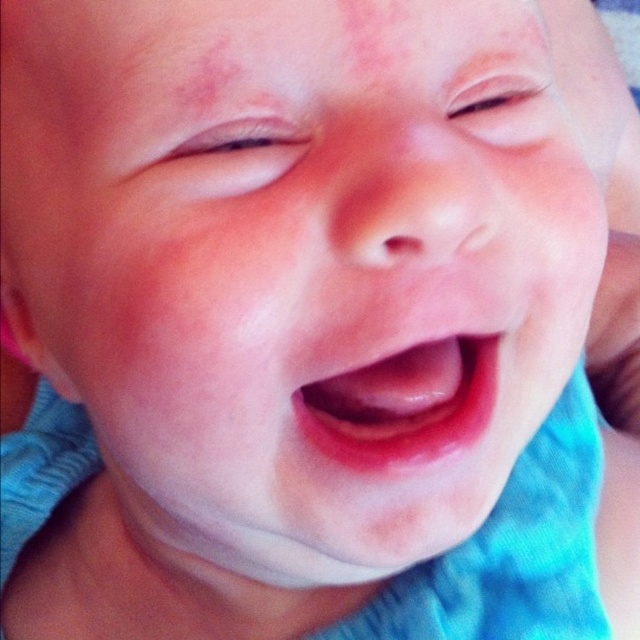
Does pink smooth skin at upper left appear on the right side of pink smooth skin at upper center?

In fact, pink smooth skin at upper left is to the left of pink smooth skin at upper center.

Is pink smooth skin at upper left thinner than pink smooth skin at upper center?

Incorrect, pink smooth skin at upper left's width is not less than pink smooth skin at upper center's.

The width and height of the screenshot is (640, 640). Describe the element at coordinates (228, 150) in the screenshot. I see `pink smooth skin at upper left` at that location.

Where is `pink smooth skin at upper left`? This screenshot has width=640, height=640. pink smooth skin at upper left is located at coordinates (228, 150).

Between pink glossy lips at center and pink smooth skin at upper left, which one appears on the left side from the viewer's perspective?

pink smooth skin at upper left

Is pink glossy lips at center positioned before pink smooth skin at upper left?

No, pink glossy lips at center is behind pink smooth skin at upper left.

The height and width of the screenshot is (640, 640). What do you see at coordinates (403, 410) in the screenshot? I see `pink glossy lips at center` at bounding box center [403, 410].

Find the location of a particular element. This screenshot has width=640, height=640. pink glossy lips at center is located at coordinates (403, 410).

Is pink smooth skin at upper center wider than pink smooth freckle at upper left?

Yes, pink smooth skin at upper center is wider than pink smooth freckle at upper left.

Describe the element at coordinates (496, 92) in the screenshot. I see `pink smooth skin at upper center` at that location.

Locate an element on the screen. pink smooth skin at upper center is located at coordinates (496, 92).